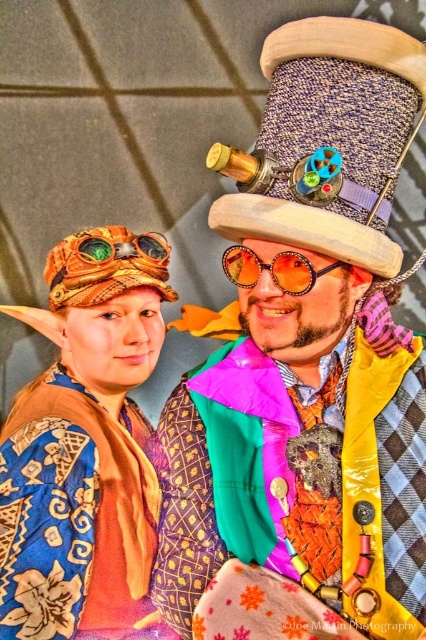
Question: Does woven fabric hat at upper center have a lesser width compared to blue silk kimono at lower left?

Choices:
 (A) yes
 (B) no

Answer: (A)

Question: From the image, what is the correct spatial relationship of blue silk kimono at lower left in relation to orange woven hat at upper left?

Choices:
 (A) right
 (B) left

Answer: (A)

Question: Estimate the real-world distances between objects in this image. Which object is closer to the multicolored fabric coat at center?

Choices:
 (A) orange woven hat at upper left
 (B) blue silk kimono at lower left
 (C) shiny orange plastic goggles at center

Answer: (C)

Question: Is woven fabric hat at upper center to the right of orange woven hat at upper left from the viewer's perspective?

Choices:
 (A) no
 (B) yes

Answer: (B)

Question: Among these objects, which one is nearest to the camera?

Choices:
 (A) shiny orange plastic goggles at center
 (B) woven fabric hat at upper center

Answer: (B)

Question: Which of the following is the closest to the observer?

Choices:
 (A) click(268, 220)
 (B) click(135, 253)
 (C) click(198, 488)

Answer: (A)